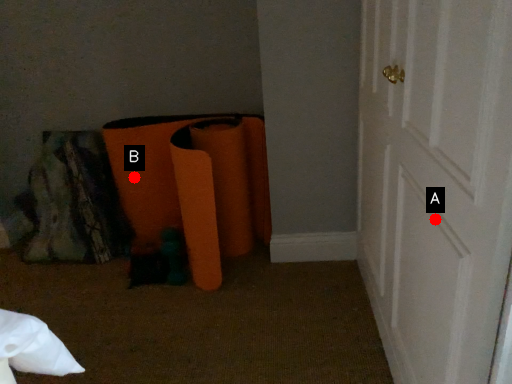
Question: Two points are circled on the image, labeled by A and B beside each circle. Which point is closer to the camera?

Choices:
 (A) A is closer
 (B) B is closer

Answer: (A)